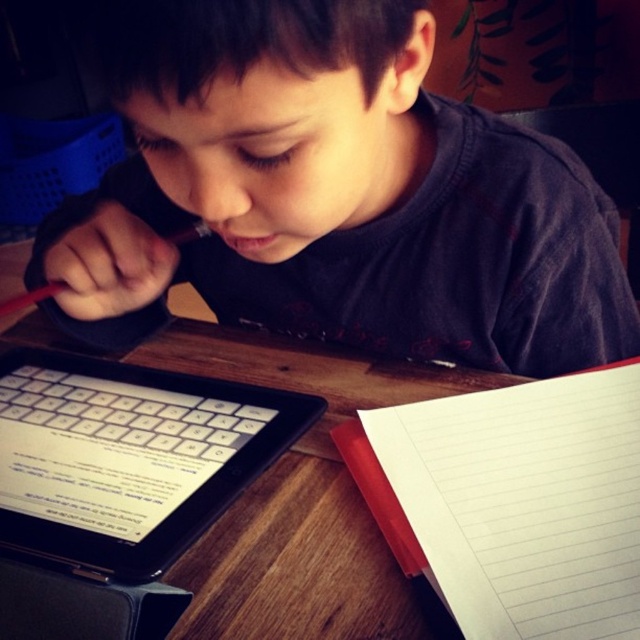
Can you confirm if matte black shirt at upper center is positioned to the left of wooden table at center?

No, matte black shirt at upper center is not to the left of wooden table at center.

Which is in front, point (449, 324) or point (285, 593)?

Point (285, 593) is in front.

Is point (289, 10) positioned behind point (371, 593)?

No, (289, 10) is closer to viewer.

Identify the location of matte black shirt at upper center. (332, 195).

Is matte black shirt at upper center taller than red matte notepad at lower right?

Yes, matte black shirt at upper center is taller than red matte notepad at lower right.

Between matte black shirt at upper center and red matte notepad at lower right, which one is positioned lower?

red matte notepad at lower right is lower down.

You are a GUI agent. You are given a task and a screenshot of the screen. Output one action in this format:
    pyautogui.click(x=<x>, y=<y>)
    Task: Click on the matte black shirt at upper center
    
    Given the screenshot: What is the action you would take?
    pyautogui.click(x=332, y=195)

Is wooden table at center taller than red matte notepad at lower right?

Yes, wooden table at center is taller than red matte notepad at lower right.

Between wooden table at center and red matte notepad at lower right, which one appears on the right side from the viewer's perspective?

red matte notepad at lower right is more to the right.

Is point (250, 365) positioned before point (364, 456)?

No, it is behind (364, 456).

Identify the location of wooden table at center. The image size is (640, 640). (300, 497).